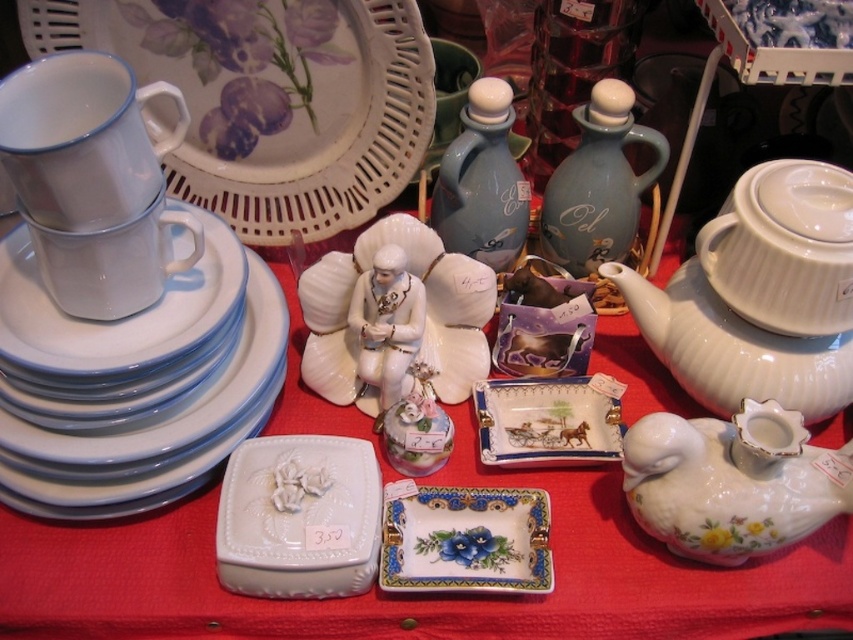
Question: Which point is farther from the camera taking this photo?

Choices:
 (A) (596, 112)
 (B) (492, 531)
 (C) (360, 376)
 (D) (537, 394)

Answer: (D)

Question: Is white glossy platter at upper left positioned before white glossy duck-shaped at lower right?

Choices:
 (A) no
 (B) yes

Answer: (A)

Question: Where is white porcelain figurine at center located in relation to porcelain tray at center in the image?

Choices:
 (A) right
 (B) left

Answer: (B)

Question: Which point appears closest to the camera in this image?

Choices:
 (A) (807, 627)
 (B) (654, 534)
 (C) (364, 385)
 (D) (167, 353)

Answer: (D)

Question: Among these objects, which one is nearest to the camera?

Choices:
 (A) white glossy platter at upper left
 (B) white glossy saucer at upper left

Answer: (B)

Question: Can you confirm if white glossy teapot at center is thinner than matte blue ceramic teapot at center?

Choices:
 (A) no
 (B) yes

Answer: (A)